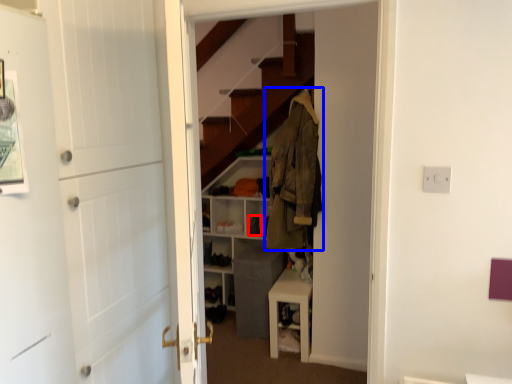
Question: Among these objects, which one is farthest to the camera, shoe (highlighted by a red box) or clothing (highlighted by a blue box)?

Choices:
 (A) shoe
 (B) clothing

Answer: (A)